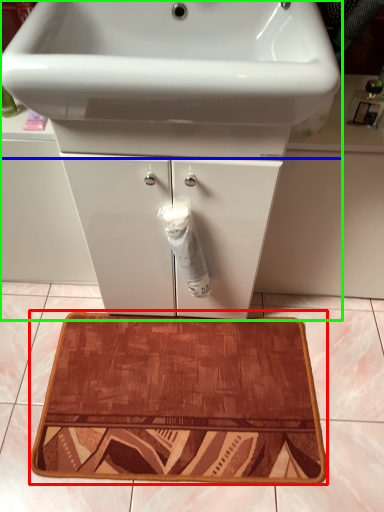
Question: Based on their relative distances, which object is nearer to bath mat (highlighted by a red box)? Choose from sink (highlighted by a blue box) and bathroom cabinet (highlighted by a green box).

Choices:
 (A) sink
 (B) bathroom cabinet

Answer: (B)